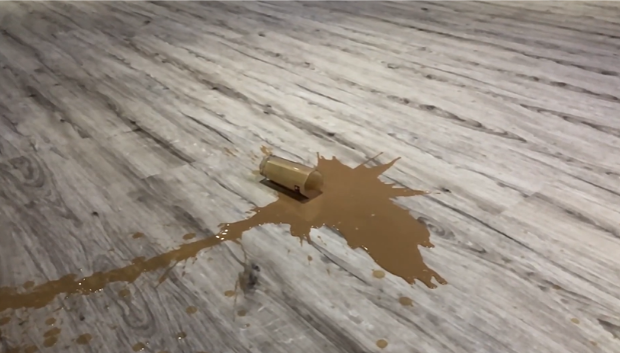
Find the location of a particular element. This screenshot has width=620, height=353. wood floor is located at coordinates (560, 257).